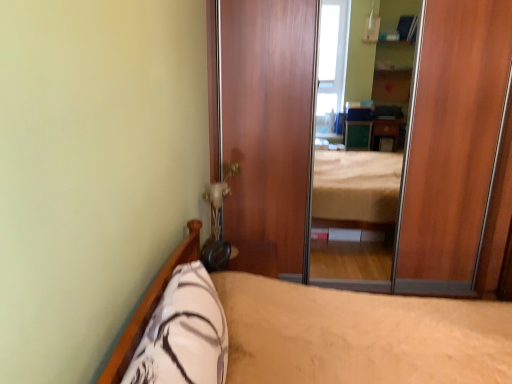
This screenshot has width=512, height=384. Identify the location of white soft pillow at lower left. (183, 334).

This screenshot has height=384, width=512. What do you see at coordinates (307, 332) in the screenshot?
I see `beige fabric bed at lower left` at bounding box center [307, 332].

What is the approximate height of beige fabric bed at lower left?

The height of beige fabric bed at lower left is 35.76 inches.

Find the location of `wooden screen door at center`. wooden screen door at center is located at coordinates (453, 156).

What's the angular difference between wooden screen door at center and beige fabric bed at lower left's facing directions?

The angle between the facing direction of wooden screen door at center and the facing direction of beige fabric bed at lower left is 89.3 degrees.

Based on their sizes in the image, would you say wooden screen door at center is bigger or smaller than beige fabric bed at lower left?

Clearly, wooden screen door at center is smaller in size than beige fabric bed at lower left.

Is beige fabric bed at lower left at the back of wooden screen door at center?

That's not correct — wooden screen door at center is not looking away from beige fabric bed at lower left.

From the image's perspective, is white soft pillow at lower left above or below beige fabric bed at lower left?

white soft pillow at lower left is above beige fabric bed at lower left.

Can you confirm if white soft pillow at lower left is taller than beige fabric bed at lower left?

No, white soft pillow at lower left is not taller than beige fabric bed at lower left.

Does white soft pillow at lower left have a larger size compared to beige fabric bed at lower left?

Incorrect, white soft pillow at lower left is not larger than beige fabric bed at lower left.

Is beige fabric bed at lower left located within white soft pillow at lower left?

That's incorrect, beige fabric bed at lower left is not inside white soft pillow at lower left.

From the image's perspective, is beige fabric bed at lower left positioned above or below wooden screen door at center?

beige fabric bed at lower left is below wooden screen door at center.

From a real-world perspective, is beige fabric bed at lower left beneath wooden screen door at center?

Yes, from a real-world perspective, beige fabric bed at lower left is under wooden screen door at center.

The height and width of the screenshot is (384, 512). In order to click on bed to the left of wooden screen door at center in this screenshot , I will do `click(307, 332)`.

Locate an element on the screen. This screenshot has width=512, height=384. pillow that is above the beige fabric bed at lower left (from a real-world perspective) is located at coordinates (183, 334).

From the image's perspective, is beige fabric bed at lower left beneath white soft pillow at lower left?

Yes, from the image's perspective, beige fabric bed at lower left is beneath white soft pillow at lower left.

Which is closer, (343, 359) or (216, 306)?

Clearly, point (343, 359) is more distant from the camera than point (216, 306).

Consider the image. Is beige fabric bed at lower left behind white soft pillow at lower left?

No, beige fabric bed at lower left is closer to the viewer.

Does wooden screen door at center appear on the left side of white soft pillow at lower left?

In fact, wooden screen door at center is to the right of white soft pillow at lower left.

Consider the image. From the image's perspective, is wooden screen door at center on top of white soft pillow at lower left?

Yes, from the image's perspective, wooden screen door at center is over white soft pillow at lower left.

Is wooden screen door at center bigger than white soft pillow at lower left?

Indeed, wooden screen door at center has a larger size compared to white soft pillow at lower left.

From a real-world perspective, which object stands above the other?

wooden screen door at center.

Consider the image. Does white soft pillow at lower left come behind wooden screen door at center?

No, it is in front of wooden screen door at center.

The height and width of the screenshot is (384, 512). I want to click on pillow below the wooden screen door at center (from the image's perspective), so click(x=183, y=334).

In the scene shown: Considering the relative sizes of white soft pillow at lower left and wooden screen door at center in the image provided, is white soft pillow at lower left smaller than wooden screen door at center?

Correct, white soft pillow at lower left occupies less space than wooden screen door at center.

Which is more to the right, white soft pillow at lower left or wooden screen door at center?

Positioned to the right is wooden screen door at center.

The width and height of the screenshot is (512, 384). In order to click on screen door above the beige fabric bed at lower left (from the image's perspective) in this screenshot , I will do 453,156.

Locate an element on the screen. pillow that is on the left side of beige fabric bed at lower left is located at coordinates (183, 334).

When comparing their distances from white soft pillow at lower left, does wooden screen door at center or beige fabric bed at lower left seem further?

wooden screen door at center is positioned further to the anchor white soft pillow at lower left.

Estimate the real-world distances between objects in this image. Which object is closer to wooden screen door at center, beige fabric bed at lower left or white soft pillow at lower left?

Among the two, beige fabric bed at lower left is located nearer to wooden screen door at center.

From the image, which object appears to be farther from wooden screen door at center, white soft pillow at lower left or beige fabric bed at lower left?

white soft pillow at lower left.

Considering their positions, is white soft pillow at lower left positioned closer to beige fabric bed at lower left than wooden screen door at center?

white soft pillow at lower left is positioned closer to the anchor beige fabric bed at lower left.

From the picture: From the image, which object appears to be nearer to beige fabric bed at lower left, wooden screen door at center or white soft pillow at lower left?

The object closer to beige fabric bed at lower left is white soft pillow at lower left.

Estimate the real-world distances between objects in this image. Which object is closer to white soft pillow at lower left, beige fabric bed at lower left or wooden screen door at center?

beige fabric bed at lower left is positioned closer to the anchor white soft pillow at lower left.

In order to click on pillow positioned between beige fabric bed at lower left and wooden screen door at center from near to far in this screenshot , I will do (183, 334).